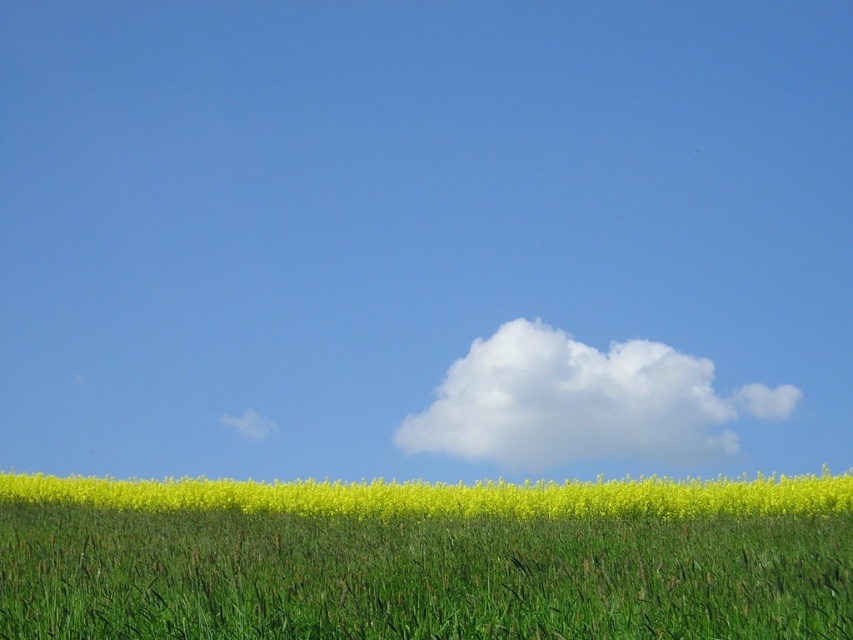
Who is positioned more to the left, white fluffy cloud at upper center or yellow matte flower at lower center?

Positioned to the left is yellow matte flower at lower center.

This screenshot has height=640, width=853. In order to click on white fluffy cloud at upper center in this screenshot , I will do `click(581, 403)`.

Where is `white fluffy cloud at upper center`? The image size is (853, 640). white fluffy cloud at upper center is located at coordinates pyautogui.click(x=581, y=403).

Is green grass at lower center taller than yellow matte flower at lower center?

Incorrect, green grass at lower center's height is not larger of yellow matte flower at lower center's.

Can you confirm if green grass at lower center is smaller than yellow matte flower at lower center?

Indeed, green grass at lower center has a smaller size compared to yellow matte flower at lower center.

Identify the location of green grass at lower center. The image size is (853, 640). (418, 577).

Can you confirm if green grass at lower center is shorter than white fluffy cloud at upper center?

Yes, green grass at lower center is shorter than white fluffy cloud at upper center.

Can you confirm if green grass at lower center is smaller than white fluffy cloud at upper center?

Indeed, green grass at lower center has a smaller size compared to white fluffy cloud at upper center.

Is point (405, 614) positioned after point (587, 387)?

No, (405, 614) is closer to viewer.

At what (x,y) coordinates should I click in order to perform the action: click on green grass at lower center. Please return your answer as a coordinate pair (x, y). The image size is (853, 640). Looking at the image, I should click on (418, 577).